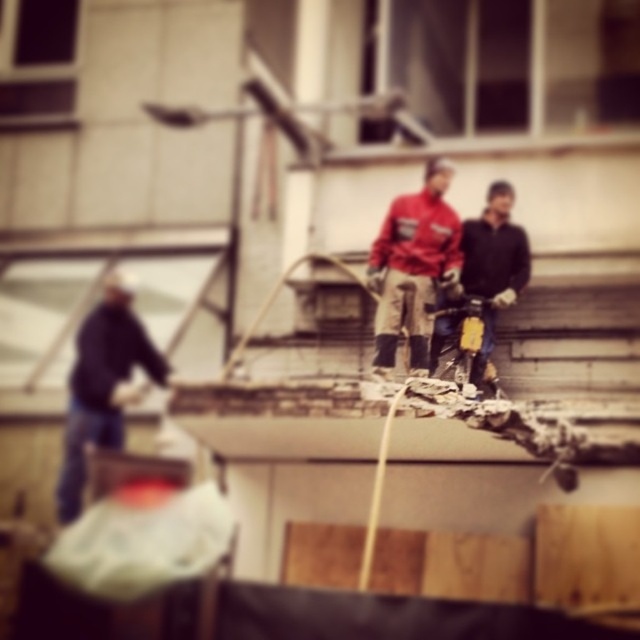
Question: Does red matte jacket at center appear on the left side of dark blue jeans at left?

Choices:
 (A) yes
 (B) no

Answer: (B)

Question: Is red matte jacket at center positioned in front of dark blue jeans at left?

Choices:
 (A) no
 (B) yes

Answer: (B)

Question: Which object is closer to the camera taking this photo?

Choices:
 (A) red matte jacket at center
 (B) dark blue jeans at left

Answer: (A)

Question: Which object appears farthest from the camera in this image?

Choices:
 (A) dark blue jeans at left
 (B) red matte jacket at center

Answer: (A)

Question: Which of the following is the closest to the observer?

Choices:
 (A) (380, 272)
 (B) (140, 330)

Answer: (A)

Question: Can you confirm if red matte jacket at center is thinner than dark blue jeans at left?

Choices:
 (A) no
 (B) yes

Answer: (B)